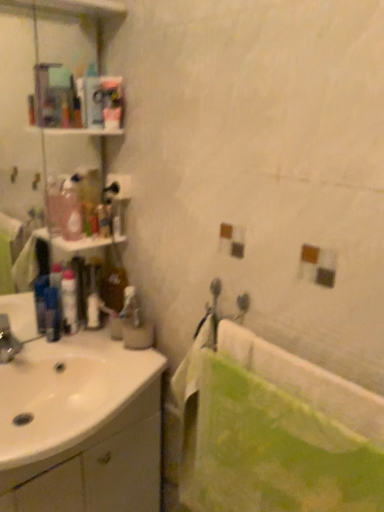
Question: Does green fabric bath at right have a greater width compared to blue plastic mouthwash at left?

Choices:
 (A) no
 (B) yes

Answer: (B)

Question: Is green fabric bath at right further to the viewer compared to blue plastic mouthwash at left?

Choices:
 (A) no
 (B) yes

Answer: (A)

Question: Does green fabric bath at right appear on the left side of blue plastic mouthwash at left?

Choices:
 (A) yes
 (B) no

Answer: (B)

Question: Considering the relative sizes of green fabric bath at right and blue plastic mouthwash at left in the image provided, is green fabric bath at right smaller than blue plastic mouthwash at left?

Choices:
 (A) yes
 (B) no

Answer: (B)

Question: Does green fabric bath at right have a lesser width compared to blue plastic mouthwash at left?

Choices:
 (A) no
 (B) yes

Answer: (A)

Question: Is green fabric bath at right aimed at blue plastic mouthwash at left?

Choices:
 (A) yes
 (B) no

Answer: (B)

Question: Considering the relative sizes of blue plastic mouthwash at left and translucent plastic bottles at left in the image provided, is blue plastic mouthwash at left bigger than translucent plastic bottles at left?

Choices:
 (A) yes
 (B) no

Answer: (A)

Question: From a real-world perspective, is blue plastic mouthwash at left under translucent plastic bottles at left?

Choices:
 (A) no
 (B) yes

Answer: (B)

Question: Does blue plastic mouthwash at left have a lesser width compared to translucent plastic bottles at left?

Choices:
 (A) yes
 (B) no

Answer: (A)

Question: From the image's perspective, is blue plastic mouthwash at left on top of translucent plastic bottles at left?

Choices:
 (A) no
 (B) yes

Answer: (A)

Question: Is blue plastic mouthwash at left aimed at translucent plastic bottles at left?

Choices:
 (A) yes
 (B) no

Answer: (B)

Question: Considering the relative positions of blue plastic mouthwash at left and translucent plastic bottles at left in the image provided, is blue plastic mouthwash at left to the right of translucent plastic bottles at left from the viewer's perspective?

Choices:
 (A) yes
 (B) no

Answer: (B)

Question: Is blue plastic mouthwash at left looking in the opposite direction of translucent plastic bottle at left?

Choices:
 (A) yes
 (B) no

Answer: (B)